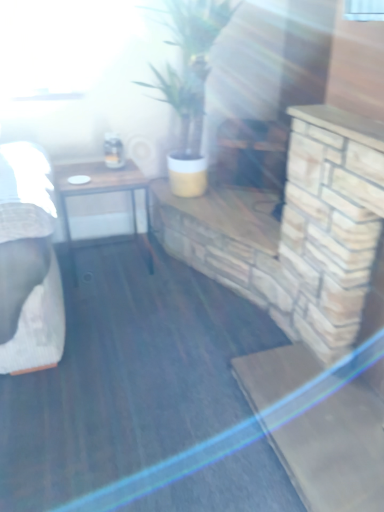
Question: Considering their positions, is wooden table at left located in front of or behind green matte plant at center?

Choices:
 (A) behind
 (B) front

Answer: (A)

Question: In terms of width, does wooden table at left look wider or thinner when compared to green matte plant at center?

Choices:
 (A) wide
 (B) thin

Answer: (B)

Question: From their relative heights in the image, would you say wooden table at left is taller or shorter than green matte plant at center?

Choices:
 (A) tall
 (B) short

Answer: (B)

Question: From a real-world perspective, is green matte plant at center physically located above or below wooden table at left?

Choices:
 (A) below
 (B) above

Answer: (B)

Question: Is green matte plant at center taller or shorter than wooden table at left?

Choices:
 (A) tall
 (B) short

Answer: (A)

Question: Would you say green matte plant at center is to the left or to the right of wooden table at left in the picture?

Choices:
 (A) left
 (B) right

Answer: (B)

Question: Is point (185, 67) closer or farther from the camera than point (112, 169)?

Choices:
 (A) farther
 (B) closer

Answer: (A)